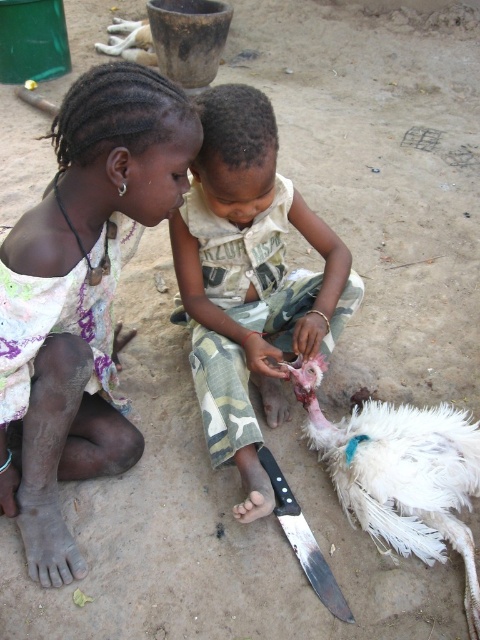
You are a photographer trying to capture a closeup of the matte white dress at left and the camouflage pants at center. Since you want both items to be in focus, which one should you adjust your camera focus on first?

The matte white dress at left is closer to the viewer than the camouflage pants at center, so you should focus on the matte white dress at left first to ensure both are in focus.

Based on the scene described, can you determine if the white feathered bird at lower right is wider than the black plastic knife at lower center?

The white feathered bird at lower right might be wider than the black plastic knife at lower center according to the description.

You are a parent observing your children playing outside. You notice the matte white dress at left and the black plastic knife at lower center. Which item is positioned higher relative to the other?

The matte white dress at left is above the black plastic knife at lower center, so the matte white dress at left is positioned higher.